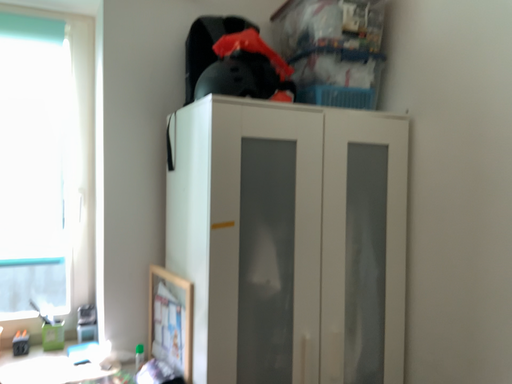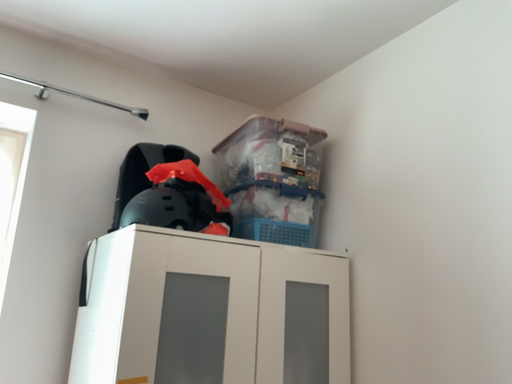
Question: Which way did the camera rotate in the video?

Choices:
 (A) rotated right
 (B) rotated left

Answer: (A)